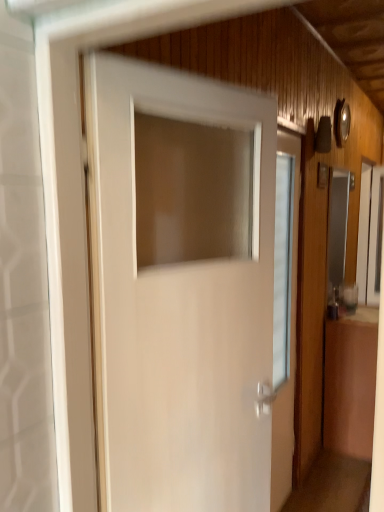
Question: From the image's perspective, is white glossy door at center located above or below clear glass window at right?

Choices:
 (A) above
 (B) below

Answer: (B)

Question: In terms of height, does white glossy door at center look taller or shorter compared to clear glass window at right?

Choices:
 (A) tall
 (B) short

Answer: (A)

Question: Visually, is white glossy door at center positioned to the left or to the right of clear glass window at right?

Choices:
 (A) right
 (B) left

Answer: (B)

Question: From the image's perspective, is clear glass window at right located above or below white glossy door at center?

Choices:
 (A) above
 (B) below

Answer: (A)

Question: Would you say clear glass window at right is to the left or to the right of white glossy door at center in the picture?

Choices:
 (A) left
 (B) right

Answer: (B)

Question: In terms of width, does clear glass window at right look wider or thinner when compared to white glossy door at center?

Choices:
 (A) thin
 (B) wide

Answer: (A)

Question: Choose the correct answer: Is clear glass window at right inside white glossy door at center or outside it?

Choices:
 (A) inside
 (B) outside

Answer: (B)